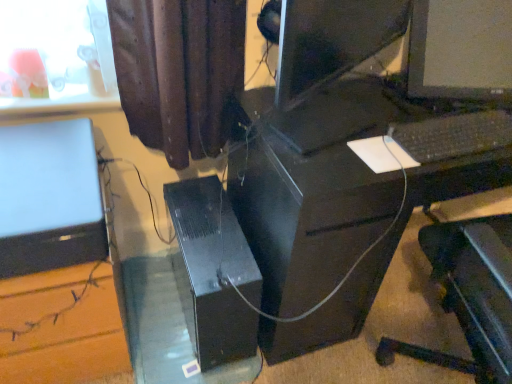
Identify the location of vacant space situated above black plastic computer tower at center (from a real-world perspective). This screenshot has width=512, height=384. (216, 240).